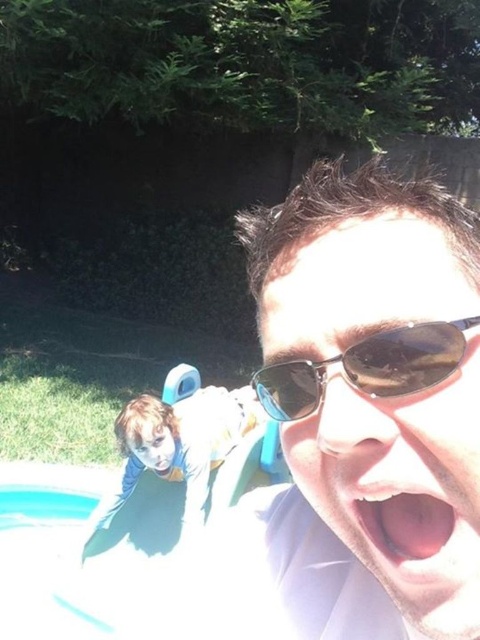
Is sunglasses at center shorter than pink flesh at center?

No, sunglasses at center is not shorter than pink flesh at center.

Is sunglasses at center above pink flesh at center?

Yes.

Describe the element at coordinates (371, 401) in the screenshot. The height and width of the screenshot is (640, 480). I see `sunglasses at center` at that location.

The height and width of the screenshot is (640, 480). I want to click on sunglasses at center, so 371,401.

Can you confirm if black reflective sunglasses at upper center is thinner than pink flesh at center?

Incorrect, black reflective sunglasses at upper center's width is not less than pink flesh at center's.

The width and height of the screenshot is (480, 640). Find the location of `black reflective sunglasses at upper center`. black reflective sunglasses at upper center is located at coordinates (368, 368).

I want to click on black reflective sunglasses at upper center, so click(368, 368).

Where is `sunglasses at center`? sunglasses at center is located at coordinates (371, 401).

Does sunglasses at center lie behind black reflective sunglasses at upper center?

That is True.

I want to click on sunglasses at center, so click(x=371, y=401).